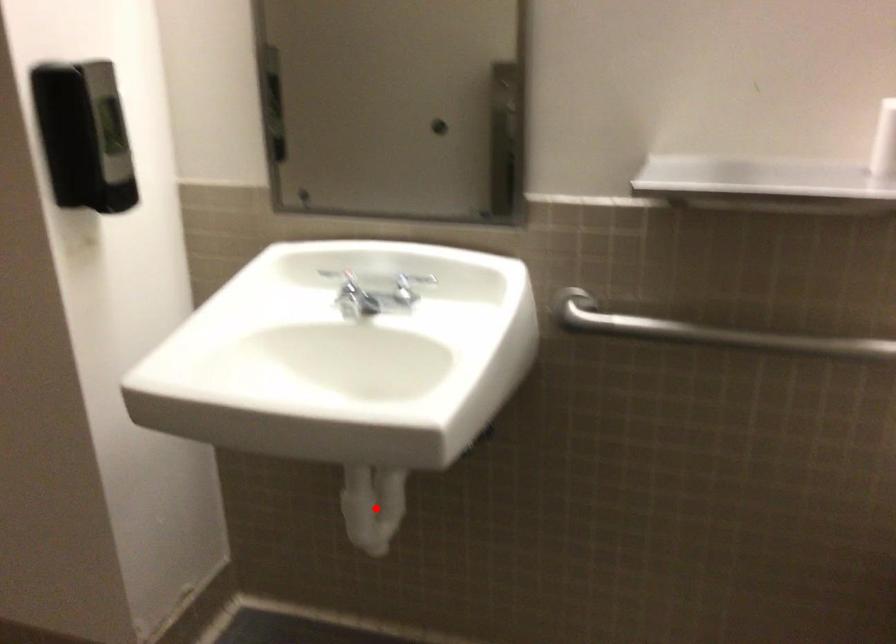
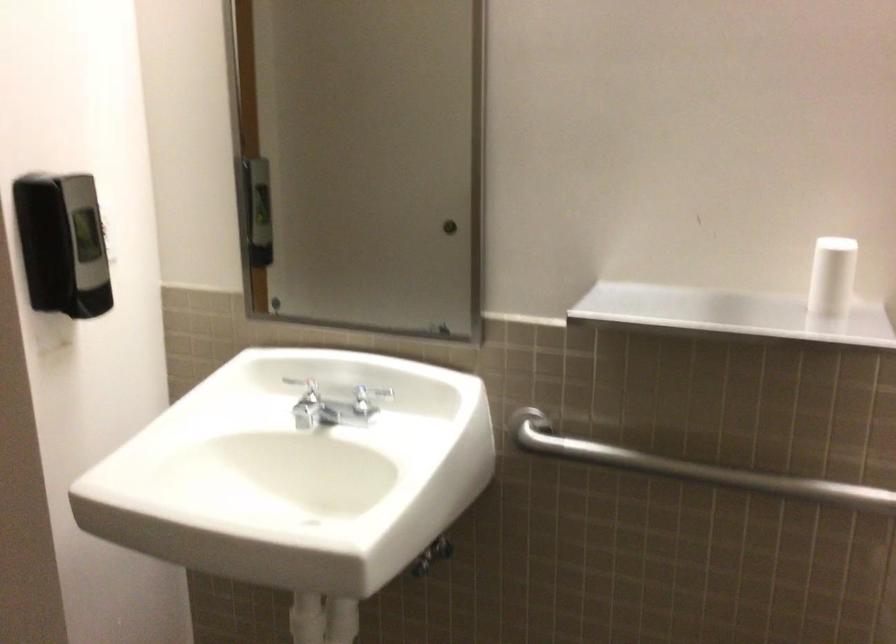
Locate, in the second image, the point that corresponds to the highlighted location in the first image.

(325, 623)